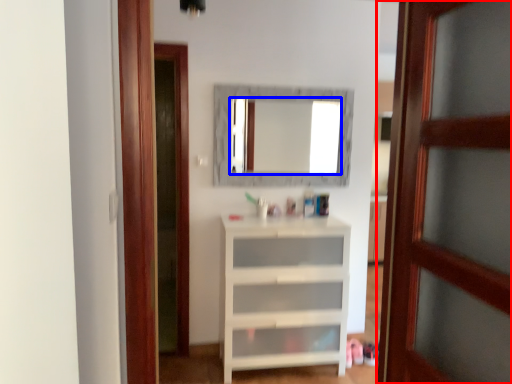
Question: Among these objects, which one is farthest to the camera, door (highlighted by a red box) or mirror (highlighted by a blue box)?

Choices:
 (A) door
 (B) mirror

Answer: (B)